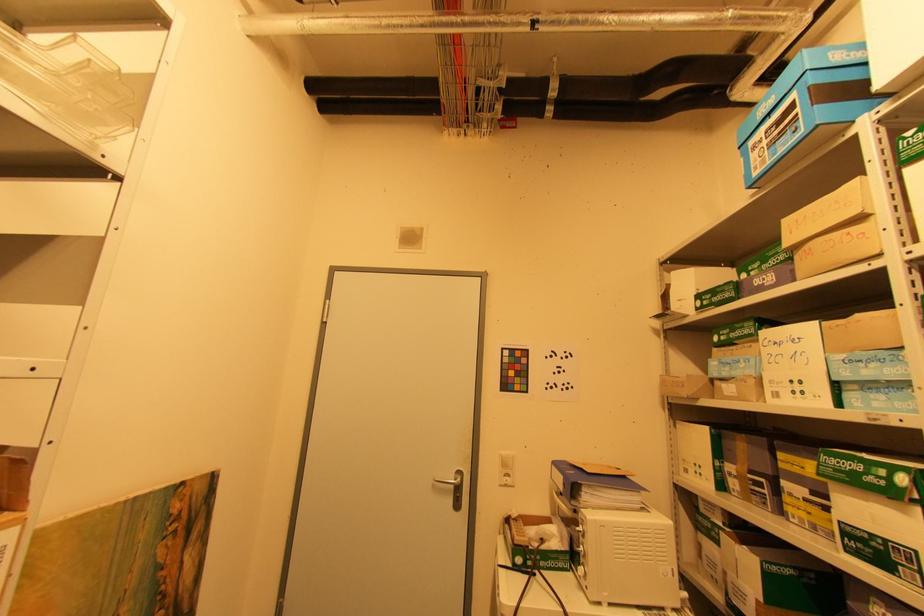
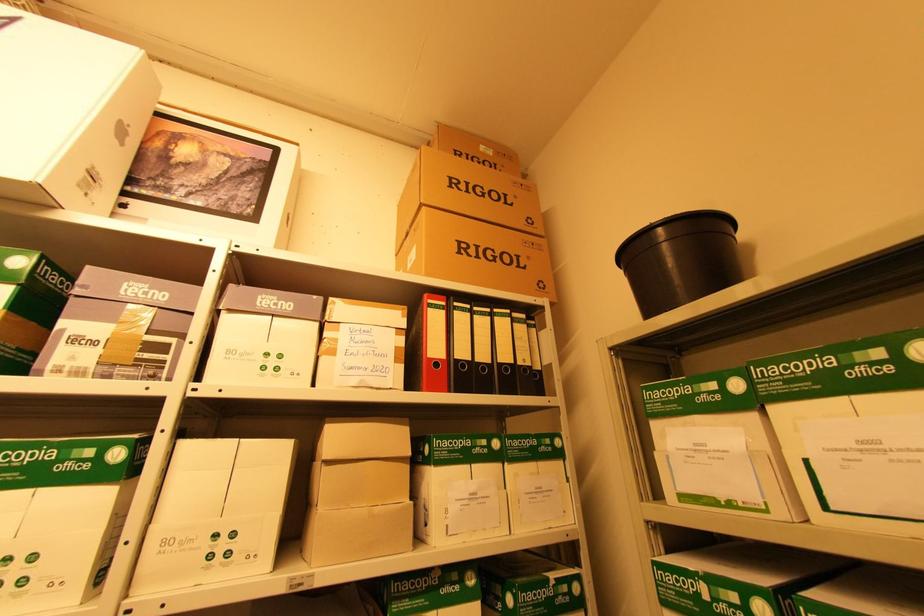
The images are taken continuously from a first-person perspective. In which direction is your viewpoint rotating?

The rotation direction of the camera is right-up.